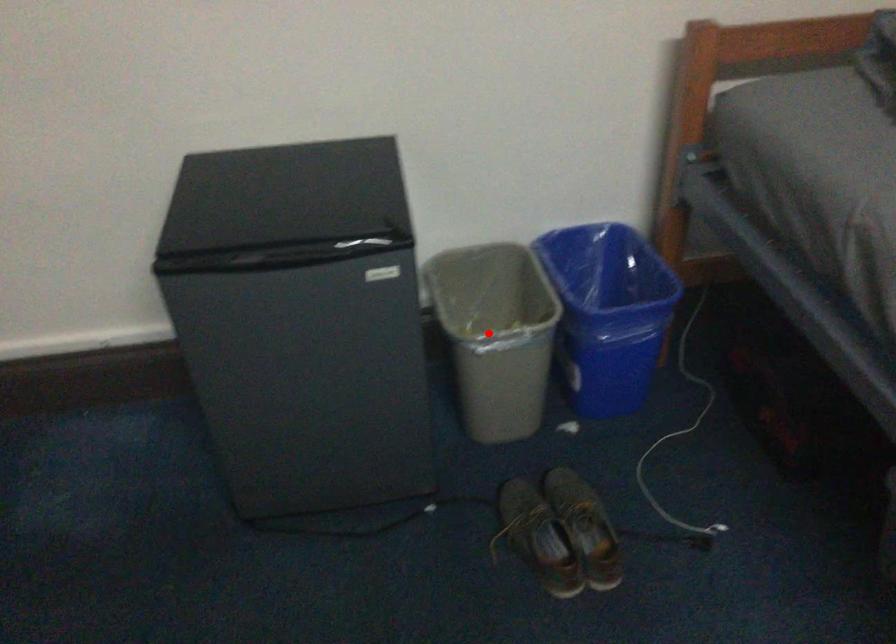
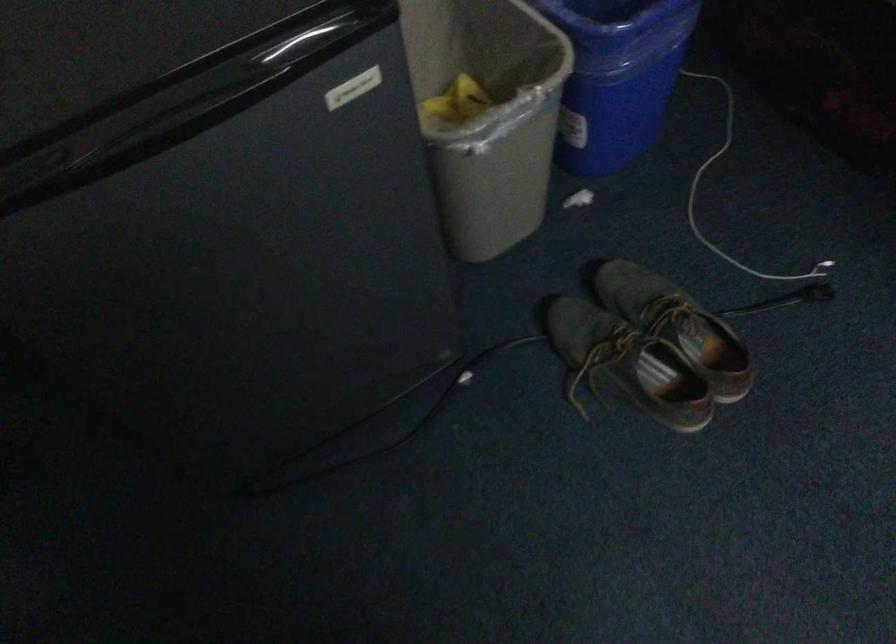
Question: A red point is marked in image1. In image2, is the corresponding 3D point closer to the camera or farther? Reply with the corresponding letter.

Choices:
 (A) The corresponding 3D point is closer.
 (B) The corresponding 3D point is farther.

Answer: (A)